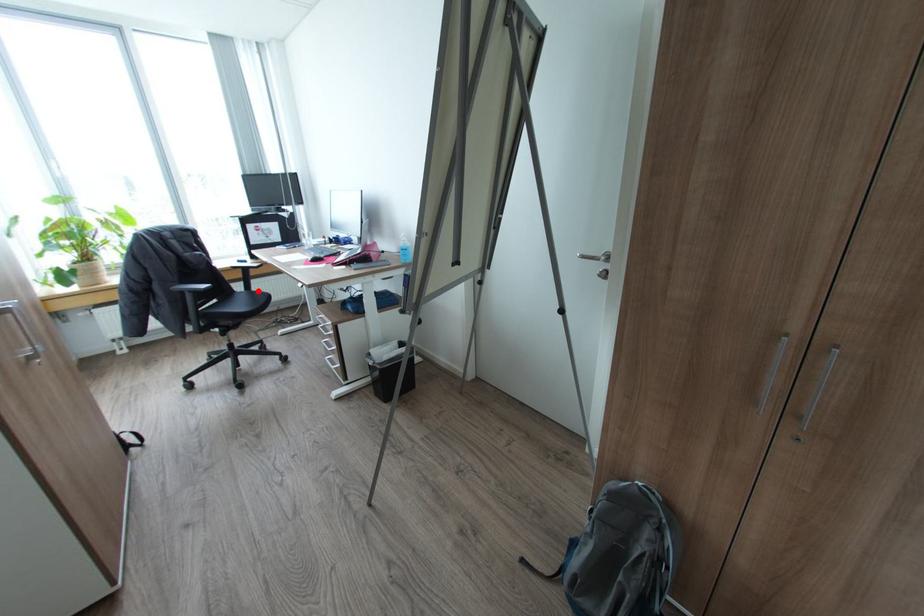
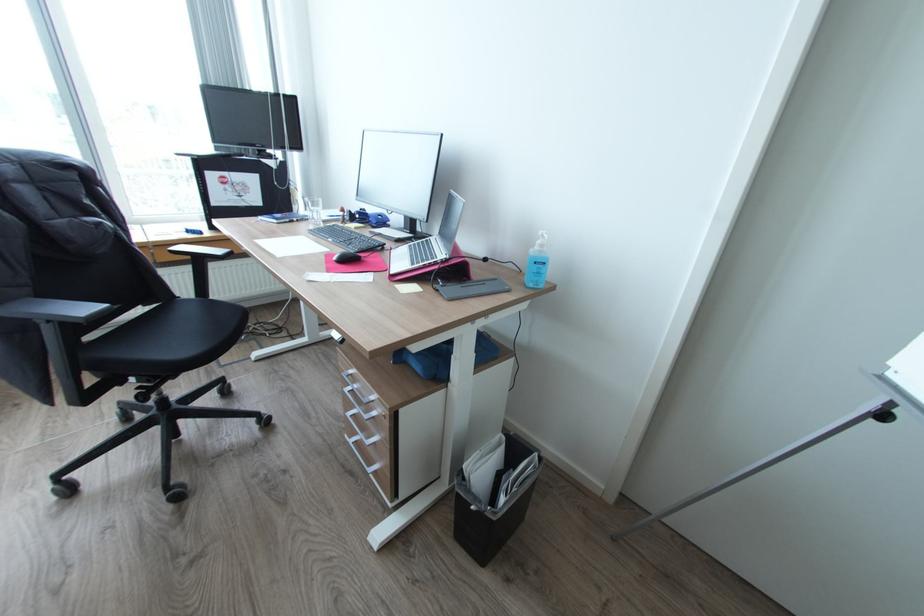
Question: I am providing you with two images of the same scene from different viewpoints. Given a red point in image1, look at the same physical point in image2. Is it:

Choices:
 (A) Closer to the viewpoint
 (B) Farther from the viewpoint

Answer: (A)